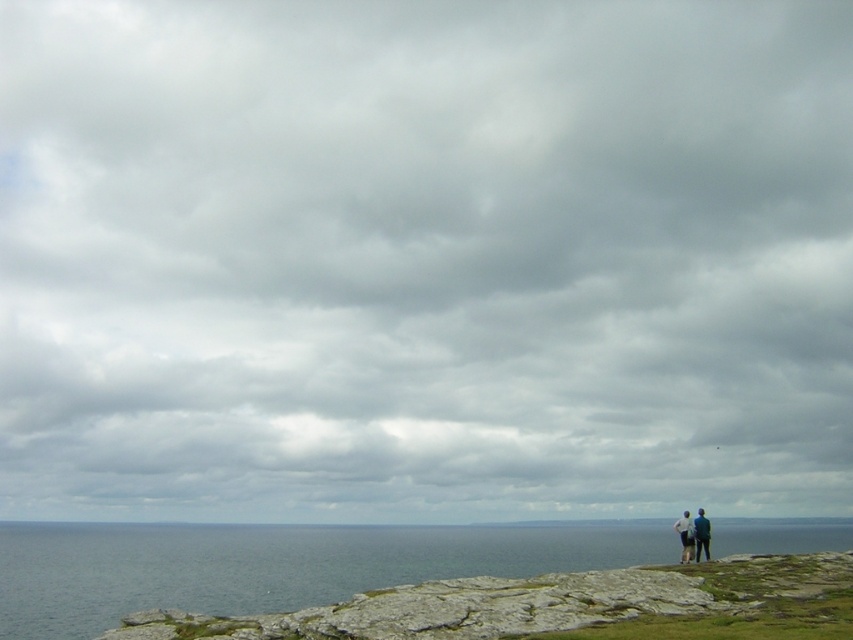
Is blue water at lower left wider than white cotton shirt at right?

Correct, the width of blue water at lower left exceeds that of white cotton shirt at right.

Does point (664, 529) lie in front of point (676, 522)?

No, it is behind (676, 522).

Identify the location of blue water at lower left. (271, 564).

Can you confirm if blue water at lower left is positioned to the right of blue denim jacket at lower right?

Indeed, blue water at lower left is positioned on the right side of blue denim jacket at lower right.

Is blue water at lower left to the left of blue denim jacket at lower right from the viewer's perspective?

No, blue water at lower left is not to the left of blue denim jacket at lower right.

Which is behind, point (630, 541) or point (693, 520)?

Point (630, 541)

Locate an element on the screen. blue water at lower left is located at coordinates (271, 564).

Describe the element at coordinates (693, 534) in the screenshot. I see `blue denim jacket at lower right` at that location.

This screenshot has width=853, height=640. Describe the element at coordinates (693, 534) in the screenshot. I see `blue denim jacket at lower right` at that location.

The height and width of the screenshot is (640, 853). In order to click on blue denim jacket at lower right in this screenshot , I will do `click(693, 534)`.